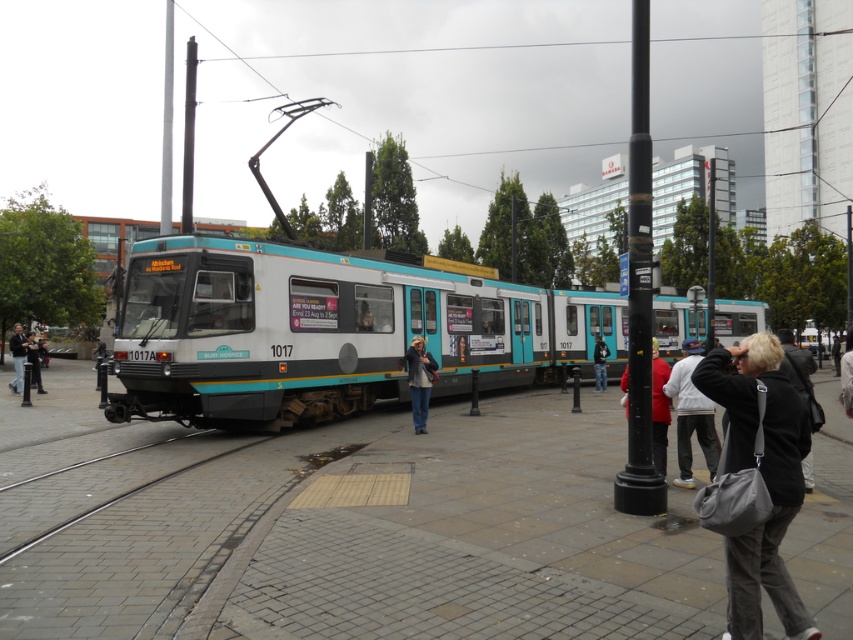
You are standing at the front of the tram and want to place a black fabric backpack at lower right. The tram has a storage compartment located at coordinate point (796, 365). Is the storage compartment the correct location to place the backpack?

Yes, the storage compartment located at coordinate point (796, 365) is the correct location to place the black fabric backpack at lower right because the point corresponds to that backpack.